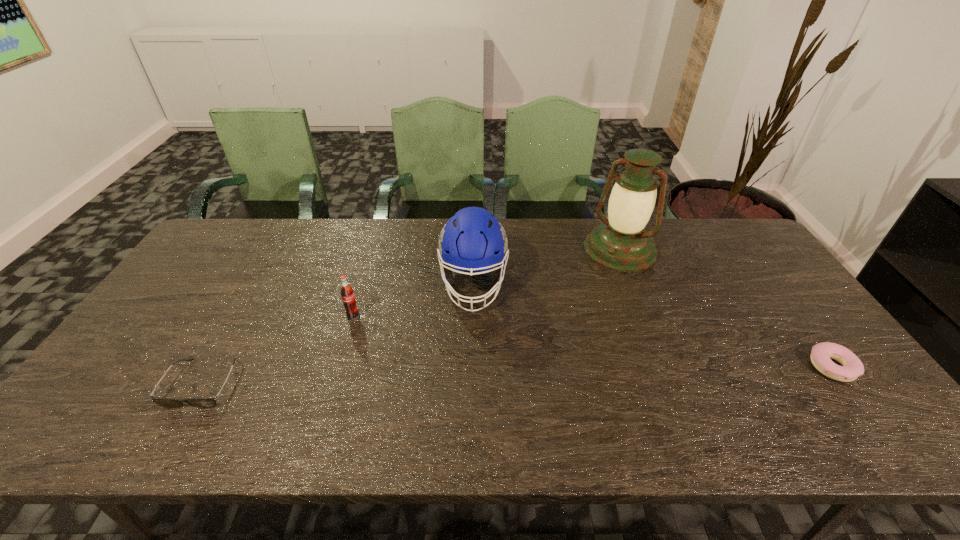
Find the location of `free space on the desktop that is between the sunglasses and the doughnut and is positioned on the label of the soda bottle`. free space on the desktop that is between the sunglasses and the doughnut and is positioned on the label of the soda bottle is located at coordinates (471, 377).

Where is `free space on the desktop that is between the leftmost object and the rightmost object and is positioned with the light compartment facing forward on the fourth object from left to right`? This screenshot has width=960, height=540. free space on the desktop that is between the leftmost object and the rightmost object and is positioned with the light compartment facing forward on the fourth object from left to right is located at coordinates (517, 376).

At what (x,y) coordinates should I click in order to perform the action: click on free space on the desktop that is between the sunglasses and the doughnut and is positioned on the face guard of the second tallest object. Please return your answer as a coordinate pair (x, y). The height and width of the screenshot is (540, 960). Looking at the image, I should click on (469, 377).